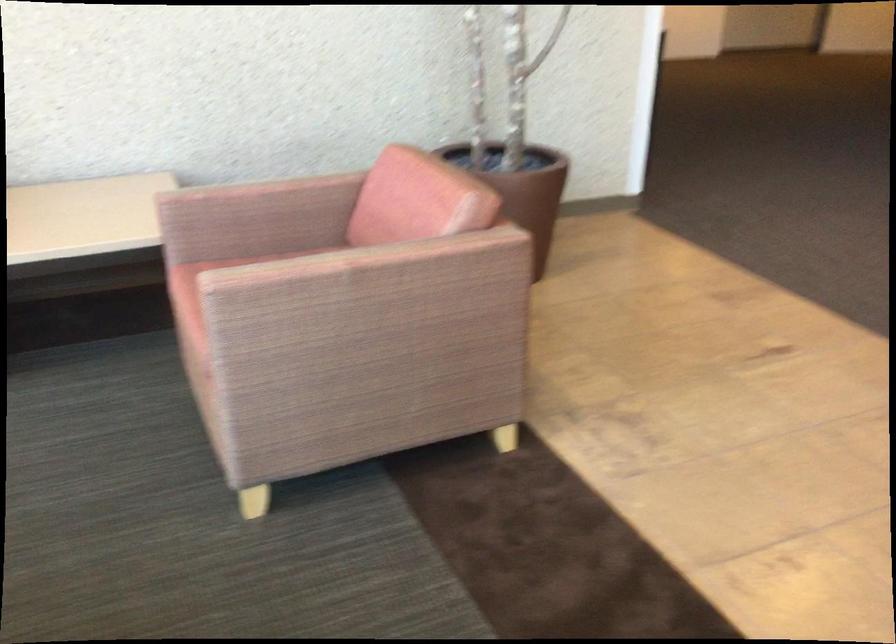
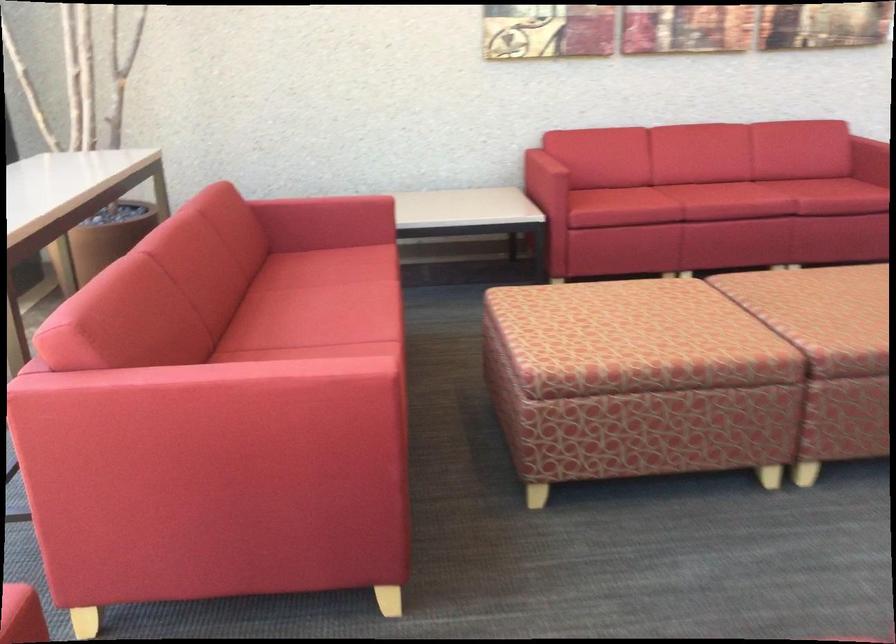
Which direction would the cameraman need to move to produce the second image?

The cameraman moved toward left, backward.